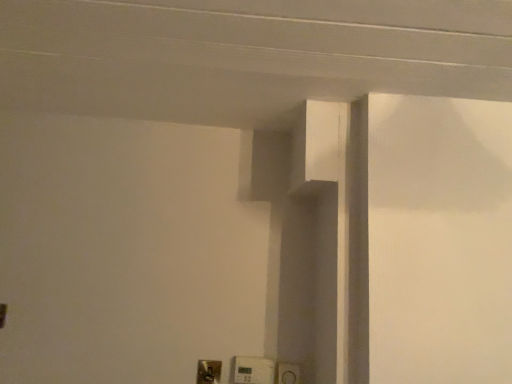
Question: Should I look upward or downward to see white plastic light switch at lower center, arranged as the second light switch when viewed from the right?

Choices:
 (A) up
 (B) down

Answer: (B)

Question: From the image's perspective, is white plastic light switch at lower center, the 1th light switch from the left, over white plastic light switch at lower center, placed as the second light switch when sorted from left to right?

Choices:
 (A) yes
 (B) no

Answer: (B)

Question: Is white plastic light switch at lower center, which ranks as the first light switch in right-to-left order, completely or partially inside white plastic light switch at lower center, arranged as the second light switch when viewed from the right?

Choices:
 (A) no
 (B) yes

Answer: (A)

Question: Is white plastic light switch at lower center, the 1th light switch from the left, positioned beyond the bounds of white plastic light switch at lower center, which ranks as the first light switch in right-to-left order?

Choices:
 (A) no
 (B) yes

Answer: (B)

Question: Is white plastic light switch at lower center, arranged as the second light switch when viewed from the right, positioned in front of white plastic light switch at lower center, which ranks as the first light switch in right-to-left order?

Choices:
 (A) no
 (B) yes

Answer: (A)

Question: Does white plastic light switch at lower center, the 1th light switch from the left, have a lesser height compared to white plastic light switch at lower center, which ranks as the first light switch in right-to-left order?

Choices:
 (A) yes
 (B) no

Answer: (A)

Question: Is white plastic light switch at lower center, the 1th light switch from the left, with white plastic light switch at lower center, placed as the second light switch when sorted from left to right?

Choices:
 (A) no
 (B) yes

Answer: (A)

Question: Does white plastic light switch at lower center, placed as the second light switch when sorted from left to right, have a lesser height compared to white plastic light switch at lower center, arranged as the second light switch when viewed from the right?

Choices:
 (A) no
 (B) yes

Answer: (A)

Question: Is white plastic light switch at lower center, arranged as the second light switch when viewed from the right, at the back of white plastic light switch at lower center, which ranks as the first light switch in right-to-left order?

Choices:
 (A) yes
 (B) no

Answer: (B)

Question: From the image's perspective, would you say white plastic light switch at lower center, which ranks as the first light switch in right-to-left order, is positioned over white plastic light switch at lower center, arranged as the second light switch when viewed from the right?

Choices:
 (A) yes
 (B) no

Answer: (A)

Question: From a real-world perspective, is white plastic light switch at lower center, which ranks as the first light switch in right-to-left order, physically below white plastic light switch at lower center, the 1th light switch from the left?

Choices:
 (A) yes
 (B) no

Answer: (B)

Question: Is white plastic light switch at lower center, placed as the second light switch when sorted from left to right, far away from white plastic light switch at lower center, the 1th light switch from the left?

Choices:
 (A) no
 (B) yes

Answer: (A)

Question: Does white plastic light switch at lower center, which ranks as the first light switch in right-to-left order, have a greater width compared to white plastic light switch at lower center, arranged as the second light switch when viewed from the right?

Choices:
 (A) no
 (B) yes

Answer: (B)

Question: From the image's perspective, relative to white plastic light switch at lower center, which ranks as the first light switch in right-to-left order, is white plastic light switch at lower center, the 1th light switch from the left, above or below?

Choices:
 (A) above
 (B) below

Answer: (B)